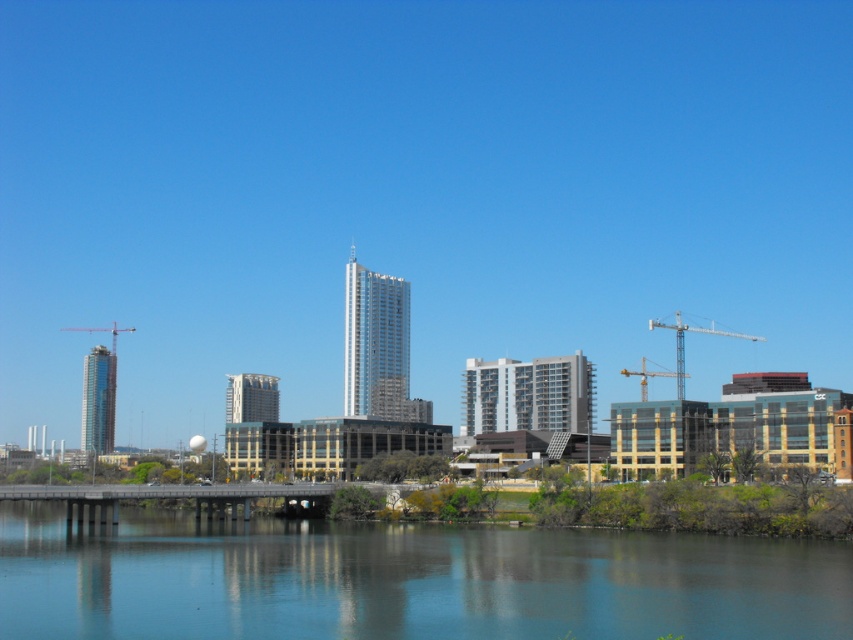
Is metallic gray crane at right taller than metallic construction crane at left?

Correct, metallic gray crane at right is much taller as metallic construction crane at left.

Is point (682, 365) closer to viewer compared to point (109, 332)?

Yes, it is in front of point (109, 332).

The width and height of the screenshot is (853, 640). What are the coordinates of `metallic gray crane at right` in the screenshot? It's located at (683, 342).

Locate an element on the screen. The image size is (853, 640). metallic gray crane at right is located at coordinates (683, 342).

Based on the photo, does transparent glass water at center have a greater height compared to metallic gray crane at right?

No, transparent glass water at center is not taller than metallic gray crane at right.

Which is more to the left, transparent glass water at center or metallic gray crane at right?

transparent glass water at center is more to the left.

Describe the element at coordinates (407, 580) in the screenshot. I see `transparent glass water at center` at that location.

Image resolution: width=853 pixels, height=640 pixels. What are the coordinates of `transparent glass water at center` in the screenshot? It's located at (407, 580).

The image size is (853, 640). In order to click on yellow metallic crane at center-right in this screenshot , I will do `click(648, 376)`.

Between yellow metallic crane at center-right and metallic construction crane at left, which one appears on the left side from the viewer's perspective?

metallic construction crane at left is more to the left.

Describe the element at coordinates (648, 376) in the screenshot. The height and width of the screenshot is (640, 853). I see `yellow metallic crane at center-right` at that location.

Where is `yellow metallic crane at center-right`? yellow metallic crane at center-right is located at coordinates (648, 376).